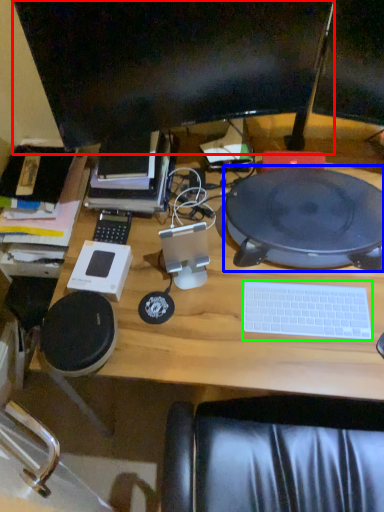
Question: Based on their relative distances, which object is nearer to computer monitor (highlighted by a red box)? Choose from tablet computer (highlighted by a blue box) and computer keyboard (highlighted by a green box).

Choices:
 (A) tablet computer
 (B) computer keyboard

Answer: (A)